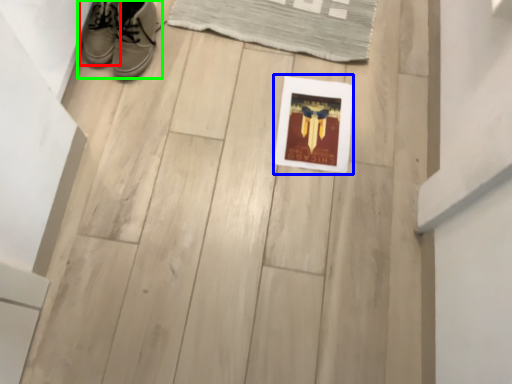
Question: Estimate the real-world distances between objects in this image. Which object is closer to footwear (highlighted by a red box), picture frame (highlighted by a blue box) or footwear (highlighted by a green box)?

Choices:
 (A) picture frame
 (B) footwear

Answer: (B)